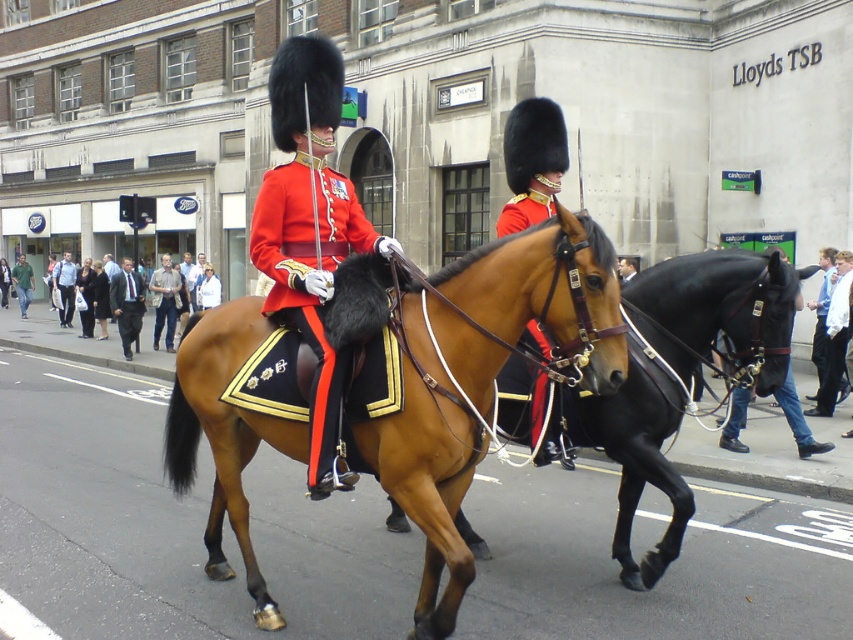
Does brown leather horse at center come behind light blue shirt at left?

That is False.

Find the location of a particular element. brown leather horse at center is located at coordinates (717, 308).

Which is in front, point (683, 358) or point (68, 278)?

Positioned in front is point (683, 358).

I want to click on brown leather horse at center, so click(717, 308).

Is shiny red fabric at center to the right of blue shirt at center from the viewer's perspective?

Incorrect, shiny red fabric at center is not on the right side of blue shirt at center.

Does shiny red fabric at center appear under blue shirt at center?

Actually, shiny red fabric at center is above blue shirt at center.

What do you see at coordinates (310, 275) in the screenshot? I see `shiny red fabric at center` at bounding box center [310, 275].

I want to click on shiny red fabric at center, so coord(310,275).

Who is higher up, shiny red fabric at center or green cotton shirt at lower left?

Positioned higher is green cotton shirt at lower left.

How distant is shiny red fabric at center from green cotton shirt at lower left?

A distance of 27.82 meters exists between shiny red fabric at center and green cotton shirt at lower left.

Image resolution: width=853 pixels, height=640 pixels. Identify the location of shiny red fabric at center. (310, 275).